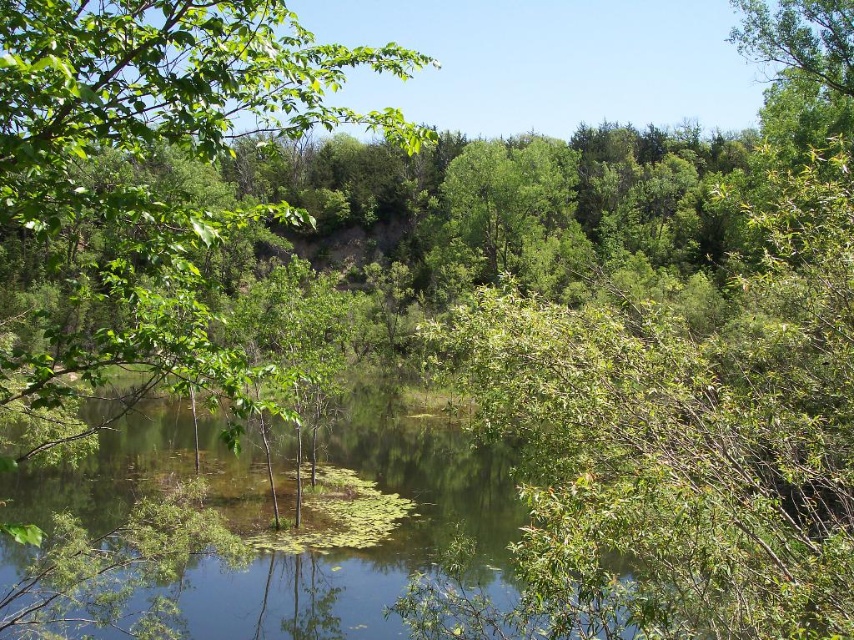
The image size is (854, 640). Find the location of `green leafy water at center`. green leafy water at center is located at coordinates (261, 536).